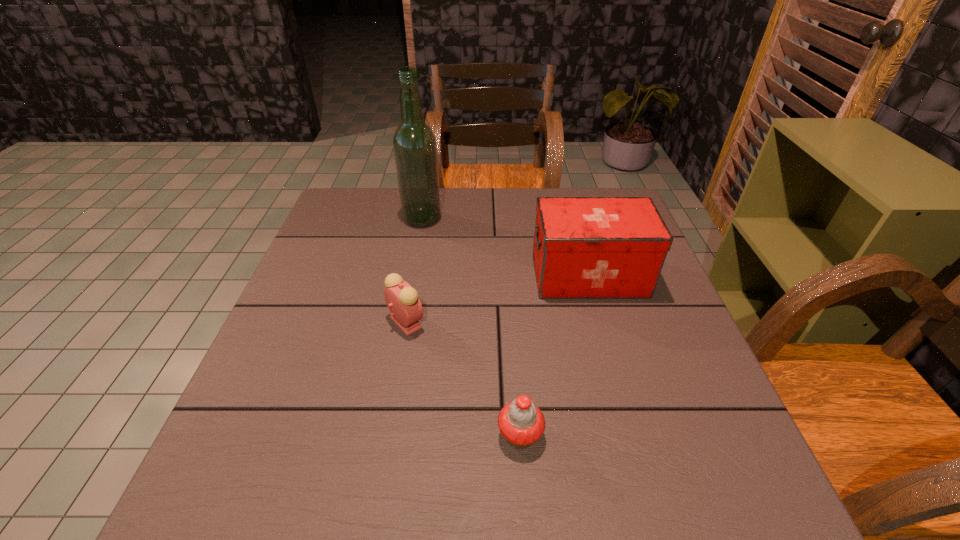
The image size is (960, 540). What are the coordinates of `free region located on the handle side of the third nearest object` in the screenshot? It's located at (492, 276).

Where is `vacant space located 0.220m on the face of the second nearest object`? vacant space located 0.220m on the face of the second nearest object is located at coordinates (525, 322).

Find the location of `vacant region located on the left of the nearest object`. vacant region located on the left of the nearest object is located at coordinates (457, 435).

I want to click on object positioned at the far edge, so click(414, 143).

You are a GUI agent. You are given a task and a screenshot of the screen. Output one action in this format:
    pyautogui.click(x=<x>, y=<y>)
    Task: Click on the object that is at the right edge
    Image resolution: width=960 pixels, height=540 pixels.
    Given the screenshot: What is the action you would take?
    pyautogui.click(x=584, y=247)

Identify the location of vacant space at the far edge of the desktop. Image resolution: width=960 pixels, height=540 pixels. (464, 226).

Where is `free spot at the near edge of the desktop`? The image size is (960, 540). free spot at the near edge of the desktop is located at coordinates [484, 497].

Locate an element on the screen. The image size is (960, 540). vacant space at the left edge is located at coordinates (367, 239).

Identify the location of vacant space at the right edge of the desktop. (675, 410).

This screenshot has height=540, width=960. What are the coordinates of `free point at the far left corner` in the screenshot? It's located at tap(333, 222).